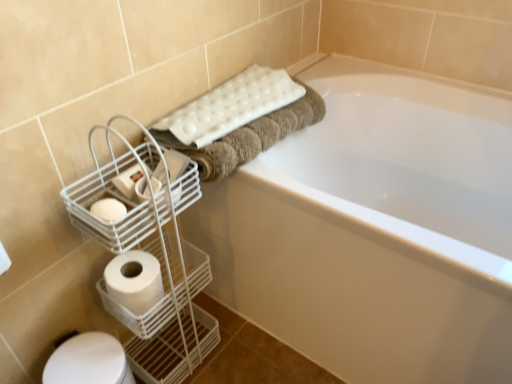
Question: Does white matte toilet paper at lower left, the first toilet paper ordered from the bottom, appear on the right side of white textured bath towel at upper center?

Choices:
 (A) no
 (B) yes

Answer: (A)

Question: From the image's perspective, is white matte toilet paper at lower left, the second toilet paper when ordered from top to bottom, on white textured bath towel at upper center?

Choices:
 (A) no
 (B) yes

Answer: (A)

Question: Does white matte toilet paper at lower left, the second toilet paper when ordered from top to bottom, have a lesser width compared to white textured bath towel at upper center?

Choices:
 (A) no
 (B) yes

Answer: (B)

Question: From a real-world perspective, does white matte toilet paper at lower left, the second toilet paper when ordered from top to bottom, stand above white textured bath towel at upper center?

Choices:
 (A) no
 (B) yes

Answer: (A)

Question: Is white matte toilet paper at lower left, the first toilet paper ordered from the bottom, in front of white textured bath towel at upper center?

Choices:
 (A) no
 (B) yes

Answer: (B)

Question: Is white matte toilet paper at lower left, the second toilet paper when ordered from top to bottom, positioned beyond the bounds of white textured bath towel at upper center?

Choices:
 (A) no
 (B) yes

Answer: (B)

Question: Is the depth of white matte toilet paper at left, acting as the second toilet paper starting from the bottom, greater than that of white glossy bathtub at upper center?

Choices:
 (A) no
 (B) yes

Answer: (B)

Question: Does white matte toilet paper at left, the 1th toilet paper from the top, have a greater width compared to white glossy bathtub at upper center?

Choices:
 (A) no
 (B) yes

Answer: (A)

Question: Considering the relative sizes of white matte toilet paper at left, the 1th toilet paper from the top, and white glossy bathtub at upper center in the image provided, is white matte toilet paper at left, the 1th toilet paper from the top, bigger than white glossy bathtub at upper center?

Choices:
 (A) no
 (B) yes

Answer: (A)

Question: From the image's perspective, does white matte toilet paper at left, the 1th toilet paper from the top, appear higher than white glossy bathtub at upper center?

Choices:
 (A) no
 (B) yes

Answer: (B)

Question: Does white matte toilet paper at left, acting as the second toilet paper starting from the bottom, have a lesser width compared to white glossy bathtub at upper center?

Choices:
 (A) no
 (B) yes

Answer: (B)

Question: Can you confirm if white matte toilet paper at left, the 1th toilet paper from the top, is shorter than white glossy bathtub at upper center?

Choices:
 (A) yes
 (B) no

Answer: (A)

Question: Does white textured bath towel at upper center have a larger size compared to white matte toilet paper at lower left, the first toilet paper ordered from the bottom?

Choices:
 (A) yes
 (B) no

Answer: (A)